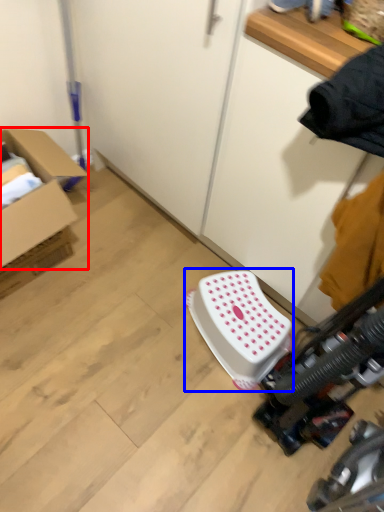
Question: Which of the following is the farthest to the observer, box (highlighted by a red box) or stool (highlighted by a blue box)?

Choices:
 (A) box
 (B) stool

Answer: (B)